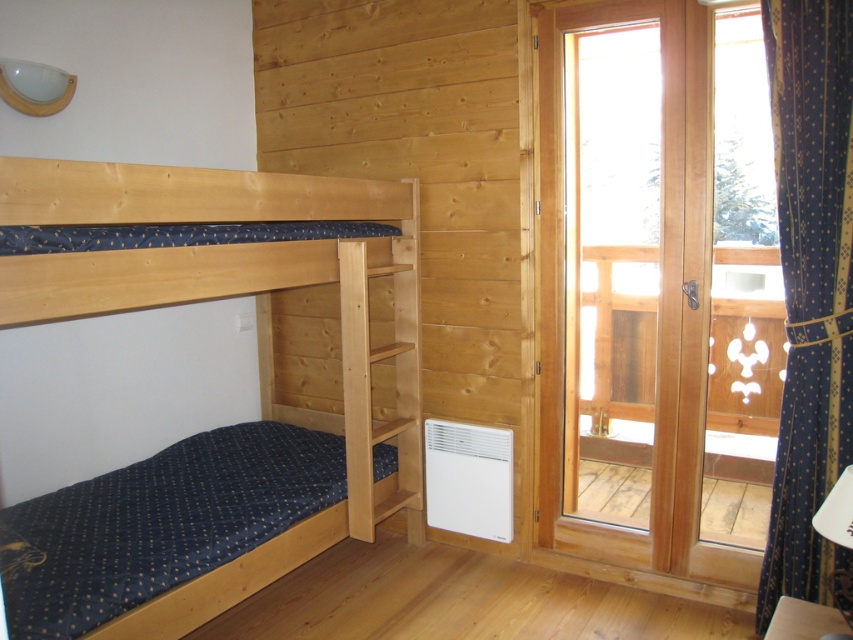
You are standing in the room and want to exit through the transparent wooden glass door at right. Based on the coordinates provided, can you determine if the door is located on the right side of the room?

The transparent wooden glass door at right is located at coordinates point (657, 285), which places it on the right side of the room.

You are moving a large piece of furniture into the room and need to know which object at the right side is larger to ensure it fits through. Which one is bigger between the transparent wooden glass door at right and the blue textured curtain at right?

The transparent wooden glass door at right is bigger than the blue textured curtain at right, so the door is larger and the curtain can be moved aside if needed.

You are moving a 5 feet long ladder into this room. You want to place it horizontally between the natural wood bunk bed at left and the blue textured curtain at right. Will the ladder fit in the space between them?

The distance between the natural wood bunk bed at left and the blue textured curtain at right is 4.81 feet. Since the ladder is 5 feet long, it will not fit as the space is slightly shorter than the ladder.